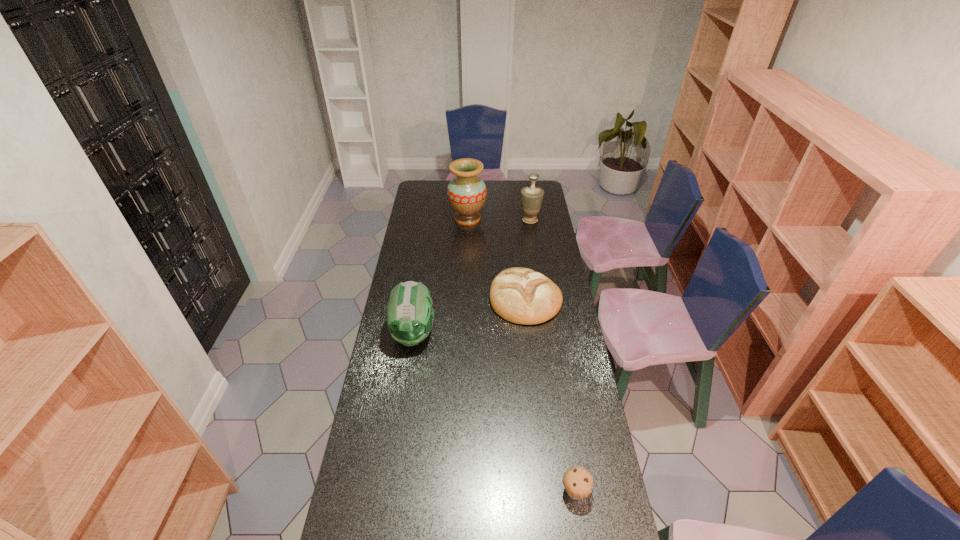
The width and height of the screenshot is (960, 540). I want to click on vase, so click(466, 193).

Find the location of a particular element. the tallest object is located at coordinates (466, 193).

Where is `urn`? urn is located at coordinates (531, 196).

Where is `the leftmost object`? The width and height of the screenshot is (960, 540). the leftmost object is located at coordinates (410, 314).

I want to click on football helmet, so click(x=410, y=314).

Where is `bread`? bread is located at coordinates (520, 295).

Find the location of a particular element. This screenshot has height=540, width=960. the shortest object is located at coordinates (577, 481).

I want to click on the nearest object, so click(577, 481).

Where is `vacant space located on the front of the vase`? vacant space located on the front of the vase is located at coordinates (466, 261).

This screenshot has height=540, width=960. I want to click on free space located on the front of the urn, so click(536, 260).